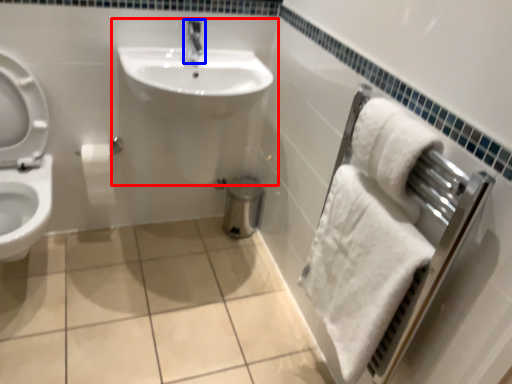
Question: Which of the following is the farthest to the observer, sink (highlighted by a red box) or tap (highlighted by a blue box)?

Choices:
 (A) sink
 (B) tap

Answer: (B)